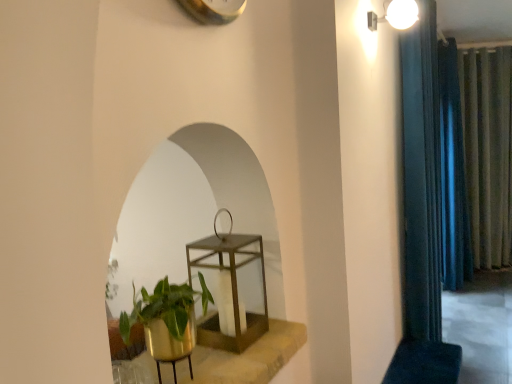
At what (x,y) coordinates should I click in order to perform the action: click on free space in front of metallic gold lantern at center. Please return your answer as a coordinate pair (x, y). Looking at the image, I should click on (228, 362).